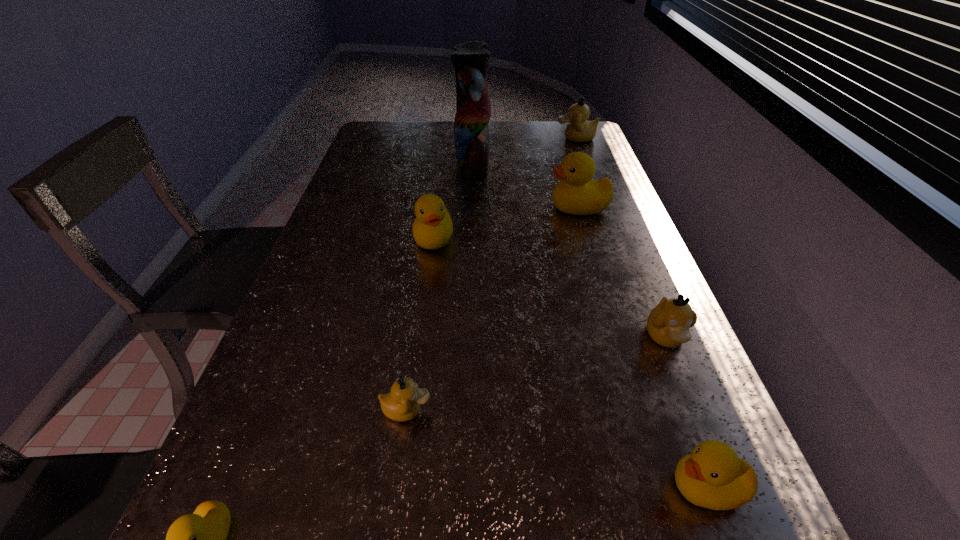
At what (x,y) coordinates should I click in order to perform the action: click on parrot. Please return your answer as a coordinate pair (x, y). This screenshot has width=960, height=540. Looking at the image, I should click on (470, 59).

This screenshot has width=960, height=540. I want to click on the farthest yellow duckling, so click(x=577, y=194).

Locate an element on the screen. The image size is (960, 540). the second farthest duckling is located at coordinates (577, 194).

Where is `the farthest duckling`? the farthest duckling is located at coordinates (579, 129).

The image size is (960, 540). What are the coordinates of `the farthest tan duckling` in the screenshot? It's located at (579, 129).

In order to click on the fourth farthest object in this screenshot , I will do `click(432, 228)`.

What are the coordinates of `the fifth nearest duckling` in the screenshot? It's located at [x=432, y=228].

Image resolution: width=960 pixels, height=540 pixels. Identify the location of the fourth nearest object. (668, 324).

Where is `the fourth farthest duckling`? the fourth farthest duckling is located at coordinates (668, 324).

Image resolution: width=960 pixels, height=540 pixels. What are the coordinates of `the second smallest yellow duckling` in the screenshot? It's located at (712, 476).